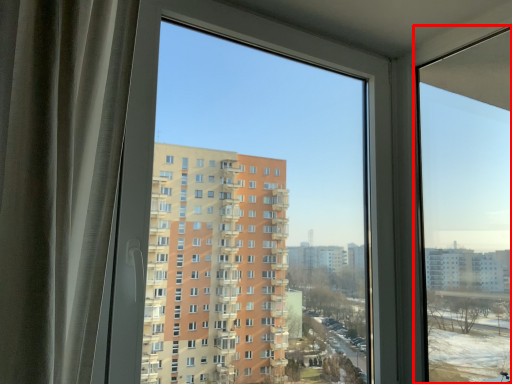
Question: In this image, where is window (annotated by the red box) located relative to window screen?

Choices:
 (A) left
 (B) right

Answer: (B)